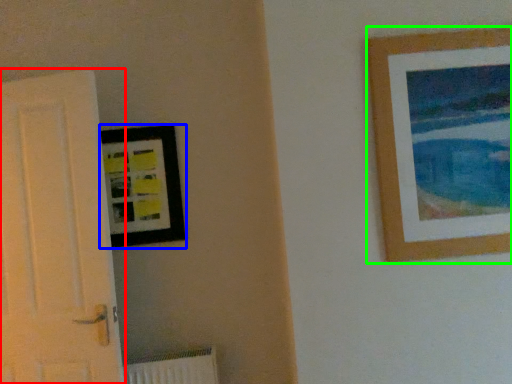
Question: Which object is the farthest from door (highlighted by a red box)? Choose among these: picture frame (highlighted by a blue box) or picture frame (highlighted by a green box).

Choices:
 (A) picture frame
 (B) picture frame

Answer: (B)